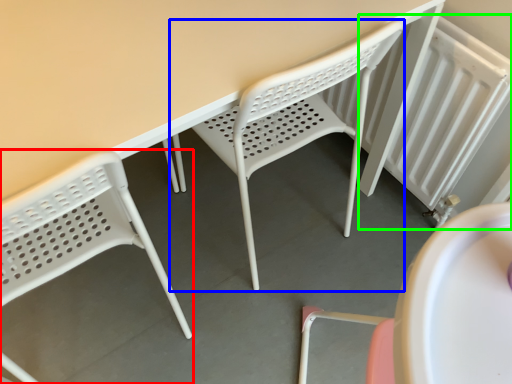
Question: Which is nearer to the chair (highlighted by a red box)? chair (highlighted by a blue box) or radiator (highlighted by a green box).

Choices:
 (A) chair
 (B) radiator

Answer: (A)